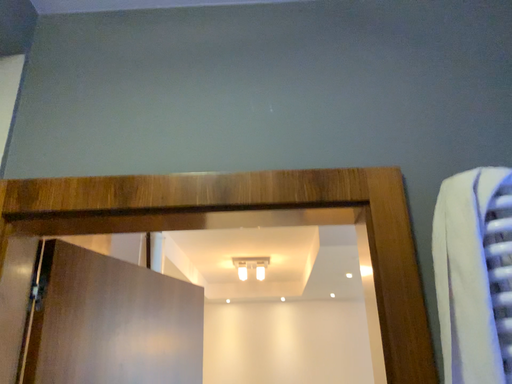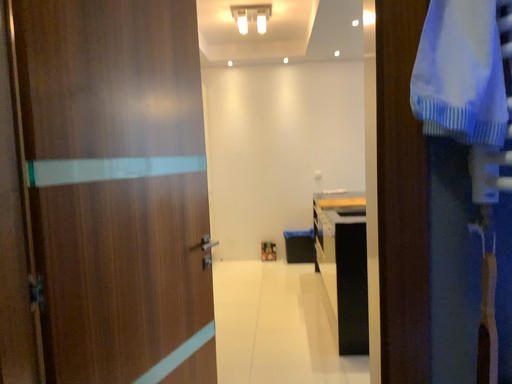
Question: Which way did the camera rotate in the video?

Choices:
 (A) rotated upward
 (B) rotated downward

Answer: (B)